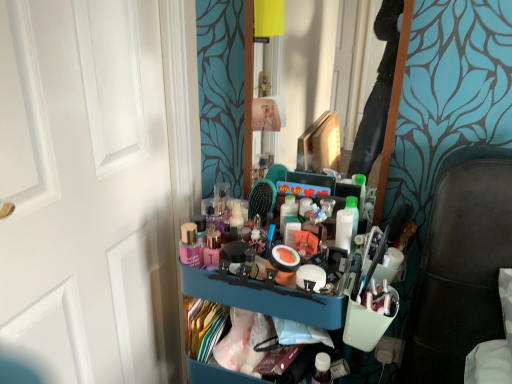
Describe the element at coordinates (337, 337) in the screenshot. The width and height of the screenshot is (512, 384). I see `blue plastic tray at center` at that location.

At what (x,y) coordinates should I click in order to perform the action: click on blue plastic bookshelf at center. Please return your answer as a coordinate pair (x, y). Looking at the image, I should click on (265, 297).

Which object is positioned more to the left, blue plastic tray at center or blue plastic bookshelf at center?

blue plastic tray at center.

Is blue plastic bookshelf at center surrounded by blue plastic tray at center?

No, blue plastic bookshelf at center is not inside blue plastic tray at center.

Is blue plastic tray at center positioned before blue plastic bookshelf at center?

No, it is not.

From the image's perspective, who appears lower, blue plastic tray at center or blue plastic bookshelf at center?

blue plastic bookshelf at center.

Is point (102, 376) more distant than point (232, 276)?

Yes, point (102, 376) is farther from viewer.

Considering the relative sizes of white matte door at left and blue plastic bookshelf at center in the image provided, is white matte door at left taller than blue plastic bookshelf at center?

Indeed, white matte door at left has a greater height compared to blue plastic bookshelf at center.

Is white matte door at left in front of or behind blue plastic bookshelf at center in the image?

white matte door at left is positioned closer to the viewer than blue plastic bookshelf at center.

How distant is white matte door at left from blue plastic bookshelf at center?

white matte door at left and blue plastic bookshelf at center are 14.32 inches apart.

Locate an element on the screen. This screenshot has width=512, height=384. door below the clear glass mirror at center (from the image's perspective) is located at coordinates (86, 192).

Does white matte door at left turn towards clear glass mirror at center?

No, white matte door at left does not turn towards clear glass mirror at center.

Can you see white matte door at left touching clear glass mirror at center?

white matte door at left and clear glass mirror at center are clearly separated.

Who is more distant, white matte door at left or clear glass mirror at center?

clear glass mirror at center.

Is blue plastic tray at center at the right side of clear glass mirror at center?

In fact, blue plastic tray at center is to the left of clear glass mirror at center.

Considering the relative sizes of blue plastic tray at center and clear glass mirror at center in the image provided, is blue plastic tray at center taller than clear glass mirror at center?

Incorrect, the height of blue plastic tray at center is not larger of that of clear glass mirror at center.

How different are the orientations of blue plastic tray at center and clear glass mirror at center in degrees?

1.36 degrees.

Based on the photo, from a real-world perspective, does blue plastic tray at center stand above clear glass mirror at center?

No.

From the image's perspective, is clear glass mirror at center on top of blue plastic bookshelf at center?

Correct, clear glass mirror at center appears higher than blue plastic bookshelf at center in the image.

From a real-world perspective, who is located higher, clear glass mirror at center or blue plastic bookshelf at center?

From a 3D spatial view, clear glass mirror at center is above.

Which is in front, clear glass mirror at center or blue plastic bookshelf at center?

blue plastic bookshelf at center is more forward.

Is clear glass mirror at center positioned far away from blue plastic bookshelf at center?

No.

Is blue plastic bookshelf at center in contact with clear glass mirror at center?

No, blue plastic bookshelf at center is not making contact with clear glass mirror at center.

Can you confirm if blue plastic bookshelf at center is bigger than clear glass mirror at center?

Indeed, blue plastic bookshelf at center has a larger size compared to clear glass mirror at center.

From a real-world perspective, is blue plastic bookshelf at center positioned over clear glass mirror at center based on gravity?

No, from a real-world perspective, blue plastic bookshelf at center is not on top of clear glass mirror at center.

Which is behind, blue plastic bookshelf at center or clear glass mirror at center?

Positioned behind is clear glass mirror at center.

Is blue plastic bookshelf at center bigger than white matte door at left?

Yes, blue plastic bookshelf at center is bigger than white matte door at left.

Which is nearer, (257,299) or (120,368)?

Positioned in front is point (257,299).

Considering the sizes of objects blue plastic bookshelf at center and white matte door at left in the image provided, who is thinner, blue plastic bookshelf at center or white matte door at left?

Thinner between the two is white matte door at left.

Identify the location of cabinet that is on the left side of blue plastic bookshelf at center. The height and width of the screenshot is (384, 512). (337, 337).

The width and height of the screenshot is (512, 384). In order to click on bookshelf on the right of white matte door at left in this screenshot , I will do `click(265, 297)`.

When comparing their distances from white matte door at left, does blue plastic bookshelf at center or blue plastic tray at center seem further?

The object further to white matte door at left is blue plastic tray at center.

From the image, which object appears to be farther from clear glass mirror at center, blue plastic tray at center or white matte door at left?

blue plastic tray at center is further to clear glass mirror at center.

Looking at this image, which object lies nearer to the anchor point blue plastic tray at center, white matte door at left or clear glass mirror at center?

white matte door at left is closer to blue plastic tray at center.

Based on their spatial positions, is blue plastic tray at center or blue plastic bookshelf at center further from white matte door at left?

blue plastic tray at center is further to white matte door at left.

When comparing their distances from white matte door at left, does blue plastic bookshelf at center or clear glass mirror at center seem closer?

Among the two, blue plastic bookshelf at center is located nearer to white matte door at left.

From the image, which object appears to be nearer to blue plastic bookshelf at center, clear glass mirror at center or white matte door at left?

Among the two, white matte door at left is located nearer to blue plastic bookshelf at center.

Based on their spatial positions, is clear glass mirror at center or blue plastic tray at center further from blue plastic bookshelf at center?

clear glass mirror at center is further to blue plastic bookshelf at center.

Based on their spatial positions, is blue plastic bookshelf at center or white matte door at left further from blue plastic tray at center?

Among the two, white matte door at left is located further to blue plastic tray at center.

Image resolution: width=512 pixels, height=384 pixels. I want to click on door between clear glass mirror at center and blue plastic tray at center vertically, so click(86, 192).

I want to click on door between clear glass mirror at center and blue plastic bookshelf at center vertically, so click(86, 192).

Image resolution: width=512 pixels, height=384 pixels. What are the coordinates of `bookshelf between white matte door at left and blue plastic tray at center along the z-axis` in the screenshot? It's located at (265, 297).

At what (x,y) coordinates should I click in order to perform the action: click on cabinet between clear glass mirror at center and blue plastic bookshelf at center in the up-down direction. Please return your answer as a coordinate pair (x, y). The height and width of the screenshot is (384, 512). Looking at the image, I should click on (337, 337).